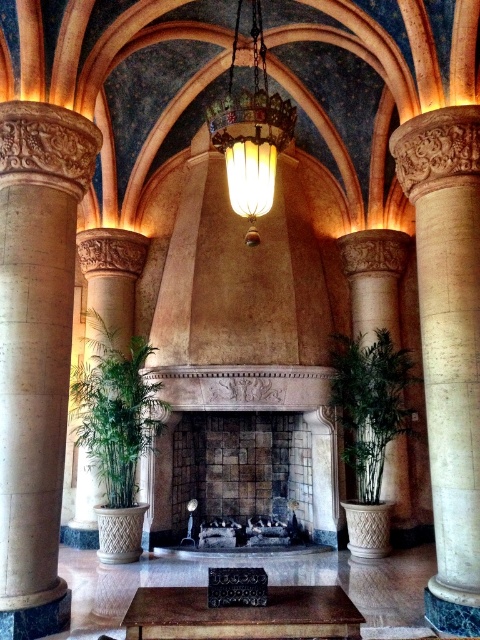
You are standing in the grand room facing the fireplace. There are two points marked in the scene at coordinates point (367, 416) and point (377, 253). Which point is closer to you?

Point (367, 416) is closer to the camera than point (377, 253).

You are an interior designer planning to place a 10 feet long sofa in this living room. You need to ensure there is enough space between the beige stone column at left and the stone fireplace at center for the sofa. Is there sufficient space?

The beige stone column at left and the stone fireplace at center are 9.52 feet apart. Since the sofa is 10 feet long, there is not enough space between them to place the sofa.